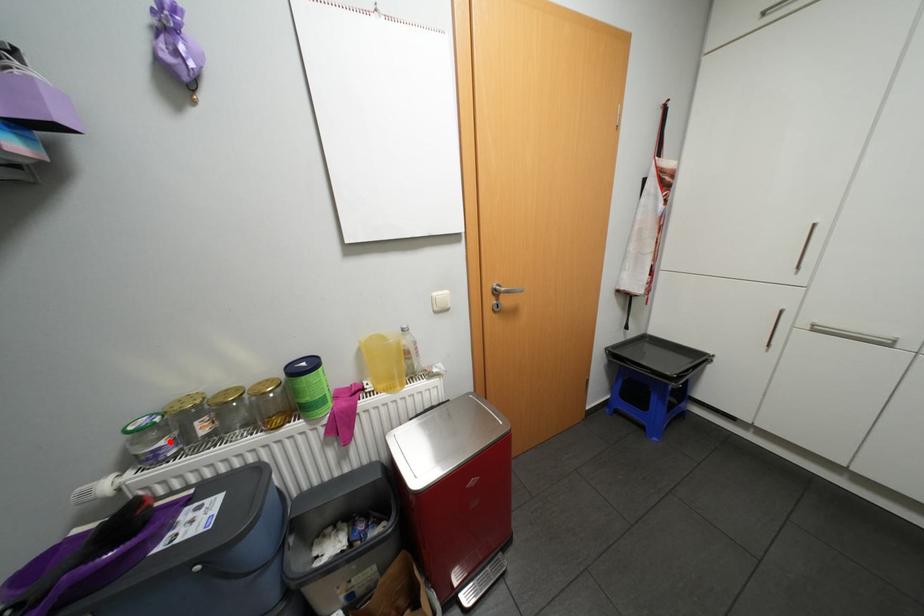
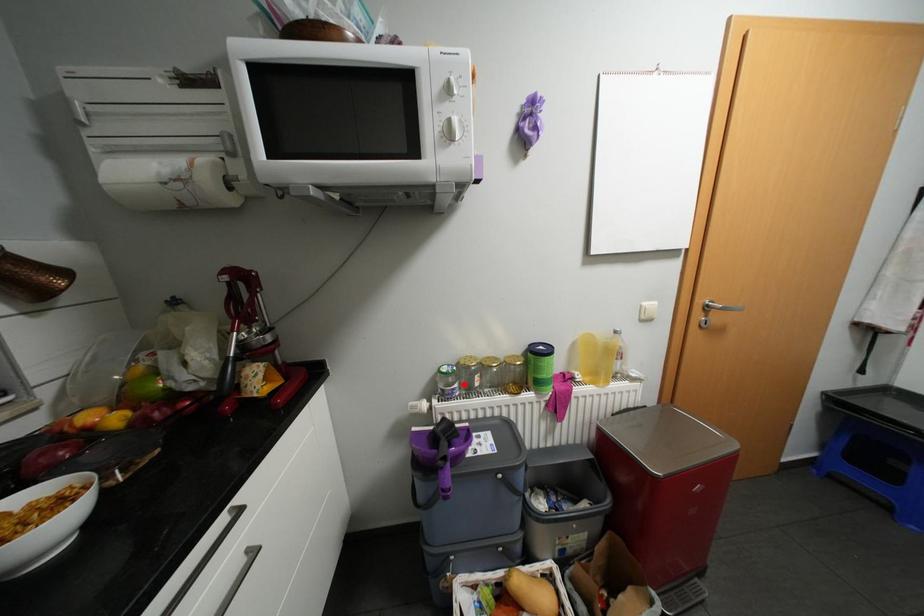
I am providing you with two images of the same scene from different viewpoints. A red point is marked on the first image and another point is marked on the second image. Do the highlighted points in image1 and image2 indicate the same real-world spot?

Yes